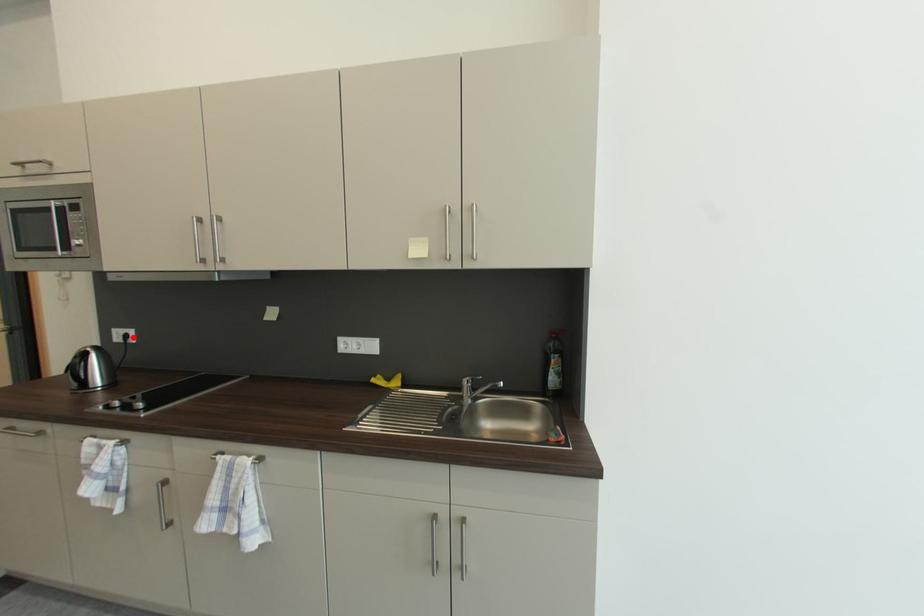
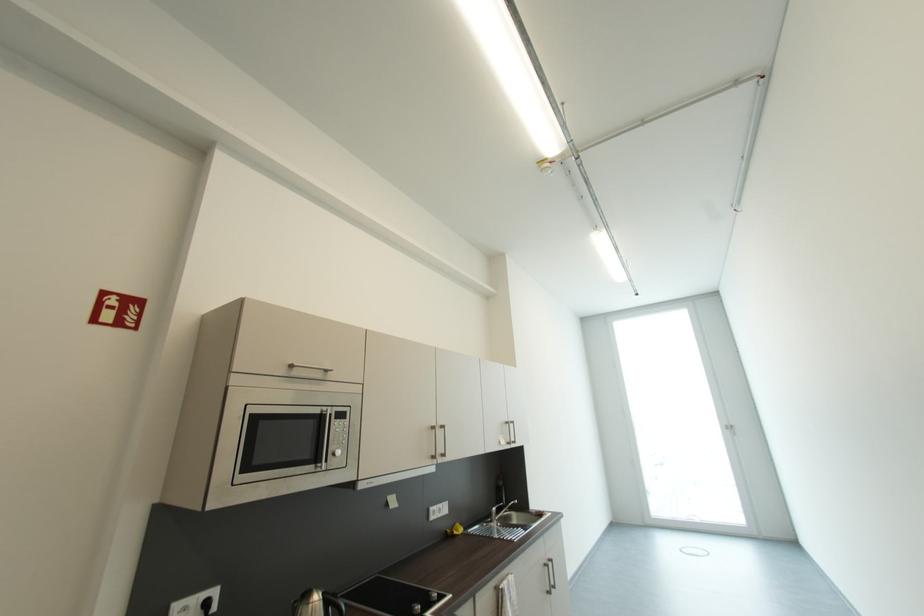
In the second image, find the point that corresponds to the highlighted location in the first image.

(213, 605)